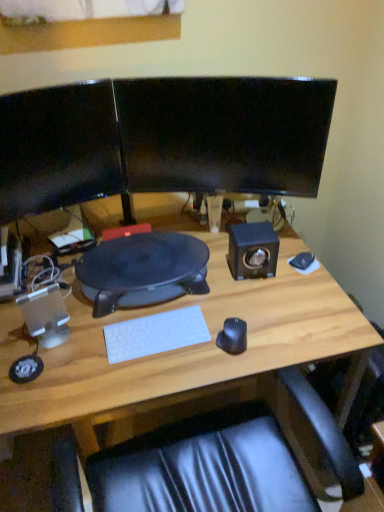
Identify the location of vacant region to the left of matte black speaker at right, positioned as the 2th speaker in front-to-back order. (211, 277).